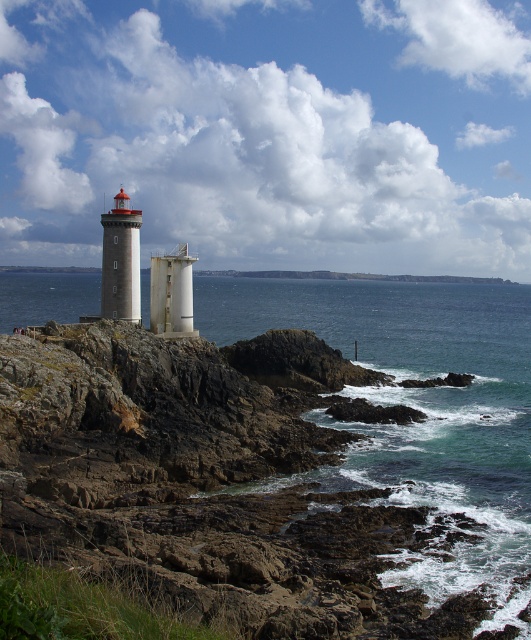
From the picture: You are a photographer positioned at the edge of the cliff overlooking the ocean. You want to capture both the white painted metal lighthouse at left and the white matte tower at center in your shot. Which object should you pan your camera towards first to include both in the frame?

You should pan your camera towards the white painted metal lighthouse at left first because it is positioned to the left of the white matte tower at center, so starting with the leftmost object ensures both are included in the frame.